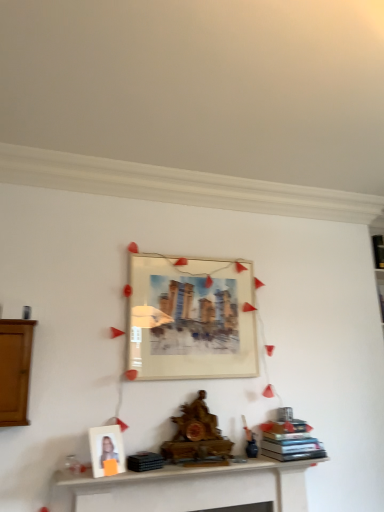
Image resolution: width=384 pixels, height=512 pixels. Identify the location of empty space that is ontop of matte white picture frame at center, which ranks as the first picture frame in right-to-left order (from a real-world perspective). (192, 258).